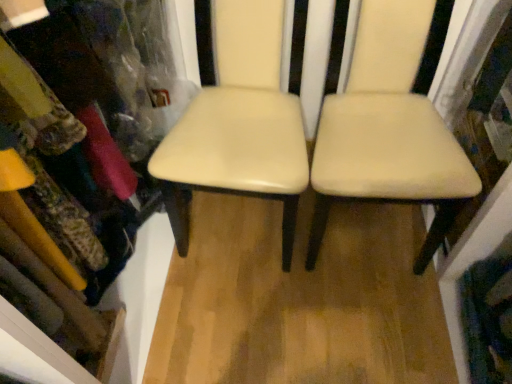
Question: From the image's perspective, is cream leather chair at center, which is the 2th chair in right-to-left order, on matte plastic bookshelf at upper left?

Choices:
 (A) yes
 (B) no

Answer: (A)

Question: Could you tell me if cream leather chair at center, acting as the 1th chair starting from the left, is turned towards matte plastic bookshelf at upper left?

Choices:
 (A) yes
 (B) no

Answer: (B)

Question: Can you confirm if cream leather chair at center, acting as the 1th chair starting from the left, is taller than matte plastic bookshelf at upper left?

Choices:
 (A) no
 (B) yes

Answer: (A)

Question: Is the surface of cream leather chair at center, which is the 2th chair in right-to-left order, in direct contact with matte plastic bookshelf at upper left?

Choices:
 (A) no
 (B) yes

Answer: (A)

Question: Is cream leather chair at center, which is the 2th chair in right-to-left order, thinner than matte plastic bookshelf at upper left?

Choices:
 (A) yes
 (B) no

Answer: (B)

Question: Are cream leather chair at center, acting as the 1th chair starting from the left, and matte plastic bookshelf at upper left located far from each other?

Choices:
 (A) yes
 (B) no

Answer: (B)

Question: From the image's perspective, does cream leather chair at center, acting as the 1th chair starting from the left, appear higher than beige leather chair at center, positioned as the first chair in right-to-left order?

Choices:
 (A) no
 (B) yes

Answer: (B)

Question: Would you say cream leather chair at center, which is the 2th chair in right-to-left order, is a long distance from beige leather chair at center, positioned as the first chair in right-to-left order?

Choices:
 (A) yes
 (B) no

Answer: (B)

Question: Can you confirm if cream leather chair at center, acting as the 1th chair starting from the left, is taller than beige leather chair at center, which is counted as the second chair, starting from the left?

Choices:
 (A) yes
 (B) no

Answer: (A)

Question: From a real-world perspective, is cream leather chair at center, acting as the 1th chair starting from the left, located higher than beige leather chair at center, which is counted as the second chair, starting from the left?

Choices:
 (A) no
 (B) yes

Answer: (B)

Question: Is cream leather chair at center, which is the 2th chair in right-to-left order, next to beige leather chair at center, positioned as the first chair in right-to-left order?

Choices:
 (A) no
 (B) yes

Answer: (A)

Question: Considering the relative sizes of cream leather chair at center, which is the 2th chair in right-to-left order, and beige leather chair at center, which is counted as the second chair, starting from the left, in the image provided, is cream leather chair at center, which is the 2th chair in right-to-left order, smaller than beige leather chair at center, which is counted as the second chair, starting from the left,?

Choices:
 (A) no
 (B) yes

Answer: (B)

Question: From the image's perspective, is matte plastic bookshelf at upper left on top of beige leather chair at center, positioned as the first chair in right-to-left order?

Choices:
 (A) no
 (B) yes

Answer: (A)